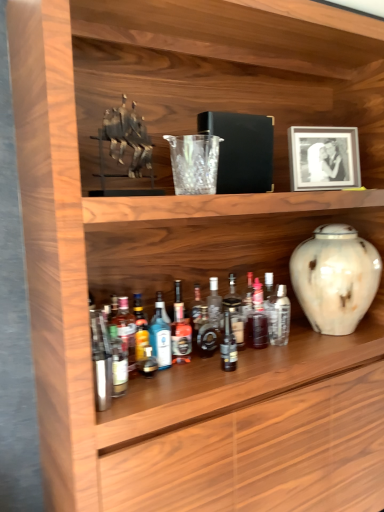
Question: Considering the relative positions of translucent glass bottle at center, the 1th bottle when ordered from left to right, and translucent glass bottle at center, placed as the 2th bottle when sorted from right to left, in the image provided, is translucent glass bottle at center, the 1th bottle when ordered from left to right, to the left of translucent glass bottle at center, placed as the 2th bottle when sorted from right to left, from the viewer's perspective?

Choices:
 (A) yes
 (B) no

Answer: (A)

Question: From the image's perspective, is translucent glass bottle at center, which appears as the seventh bottle when viewed from the right, on top of translucent glass bottle at center, placed as the 2th bottle when sorted from right to left?

Choices:
 (A) yes
 (B) no

Answer: (B)

Question: Is translucent glass bottle at center, which appears as the seventh bottle when viewed from the right, positioned far away from translucent glass bottle at center, the sixth bottle when ordered from left to right?

Choices:
 (A) no
 (B) yes

Answer: (A)

Question: Considering the relative positions of translucent glass bottle at center, which appears as the seventh bottle when viewed from the right, and translucent glass bottle at center, placed as the 2th bottle when sorted from right to left, in the image provided, is translucent glass bottle at center, which appears as the seventh bottle when viewed from the right, to the right of translucent glass bottle at center, placed as the 2th bottle when sorted from right to left, from the viewer's perspective?

Choices:
 (A) no
 (B) yes

Answer: (A)

Question: Is translucent glass bottle at center, which appears as the seventh bottle when viewed from the right, taller than translucent glass bottle at center, placed as the 2th bottle when sorted from right to left?

Choices:
 (A) no
 (B) yes

Answer: (A)

Question: Visually, is shiny dark glass bottle at center, which is the fourth bottle from right to left, positioned to the left or to the right of black matte picture frame at upper right?

Choices:
 (A) right
 (B) left

Answer: (B)

Question: From the image's perspective, is shiny dark glass bottle at center, the 4th bottle positioned from the left, located above or below black matte picture frame at upper right?

Choices:
 (A) below
 (B) above

Answer: (A)

Question: Is shiny dark glass bottle at center, which is the fourth bottle from right to left, situated inside black matte picture frame at upper right or outside?

Choices:
 (A) outside
 (B) inside

Answer: (A)

Question: From a real-world perspective, is shiny dark glass bottle at center, the 4th bottle positioned from the left, above or below black matte picture frame at upper right?

Choices:
 (A) below
 (B) above

Answer: (A)

Question: In the image, is translucent glass bottle at center, the sixth bottle when ordered from left to right, on the left side or the right side of clear glass bottle at center, acting as the seventh bottle starting from the left?

Choices:
 (A) right
 (B) left

Answer: (B)

Question: Which is correct: translucent glass bottle at center, placed as the 2th bottle when sorted from right to left, is inside clear glass bottle at center, acting as the seventh bottle starting from the left, or outside of it?

Choices:
 (A) inside
 (B) outside

Answer: (B)

Question: Looking at their shapes, would you say translucent glass bottle at center, the sixth bottle when ordered from left to right, is wider or thinner than clear glass bottle at center, positioned as the first bottle in right-to-left order?

Choices:
 (A) wide
 (B) thin

Answer: (B)

Question: From a real-world perspective, is translucent glass bottle at center, placed as the 2th bottle when sorted from right to left, physically located above or below clear glass bottle at center, acting as the seventh bottle starting from the left?

Choices:
 (A) above
 (B) below

Answer: (A)

Question: From the image's perspective, is translucent glass bottle at center, the 1th bottle when ordered from left to right, positioned above or below translucent glass bottle at center, placed as the 2th bottle when sorted from right to left?

Choices:
 (A) above
 (B) below

Answer: (B)

Question: From a real-world perspective, is translucent glass bottle at center, the 1th bottle when ordered from left to right, above or below translucent glass bottle at center, the sixth bottle when ordered from left to right?

Choices:
 (A) above
 (B) below

Answer: (B)